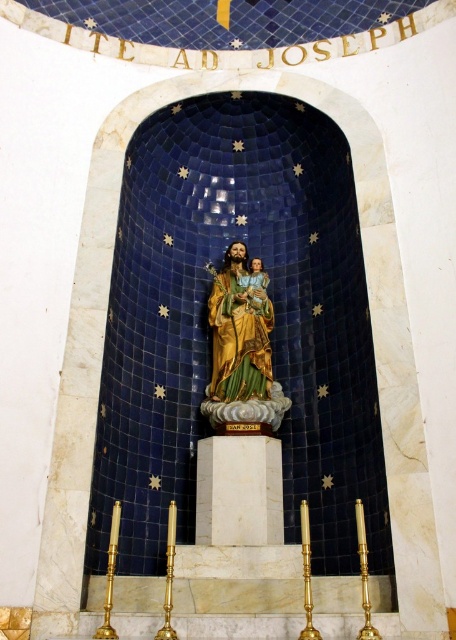
Can you confirm if gold-painted statue at center is shorter than gold metallic statue at center?

In fact, gold-painted statue at center may be taller than gold metallic statue at center.

Which of these two, gold-painted statue at center or gold metallic statue at center, stands taller?

gold-painted statue at center is taller.

Is point (250, 321) farther from camera compared to point (241, 284)?

No, (250, 321) is in front of (241, 284).

Identify the location of gold-painted statue at center. Image resolution: width=456 pixels, height=640 pixels. (238, 333).